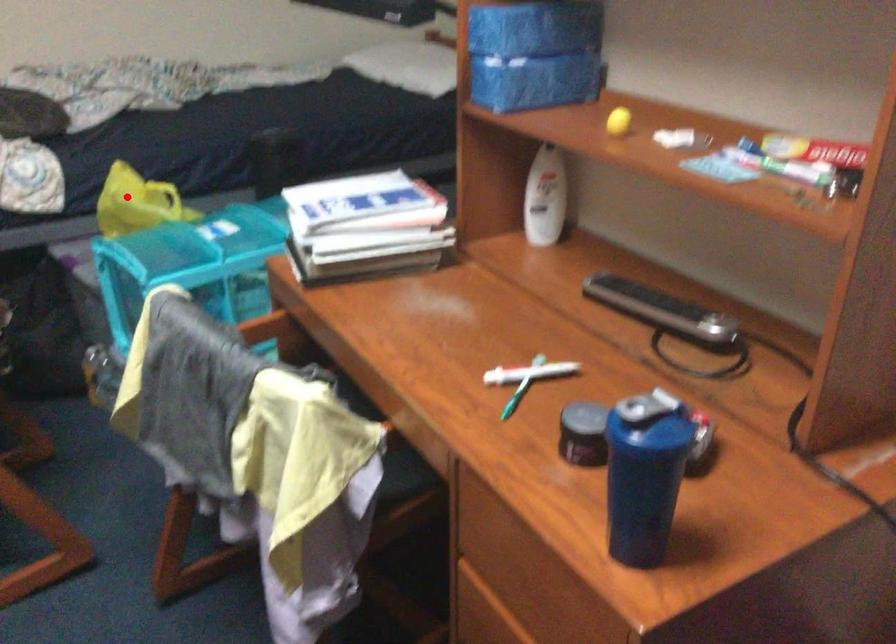
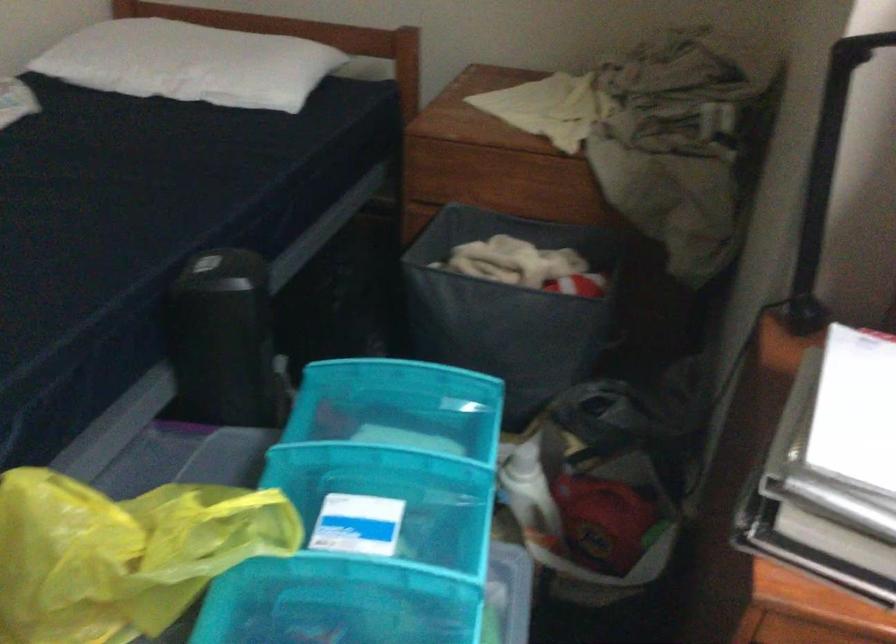
Question: I am providing you with two images of the same scene from different viewpoints. Image1 has a red point marked. In image2, the corresponding 3D location appears at what relative position? Reply with the corresponding letter.

Choices:
 (A) Closer
 (B) Farther

Answer: (A)